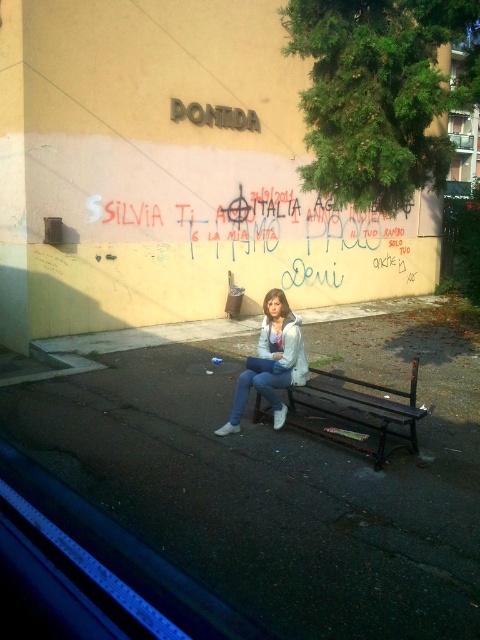
Based on the photo, is red graffiti at center positioned before white matte jacket at center?

No, it is not.

Can you confirm if red graffiti at center is positioned to the right of white matte jacket at center?

Incorrect, red graffiti at center is not on the right side of white matte jacket at center.

Who is more forward, (377, 224) or (279, 324)?

Point (279, 324)

This screenshot has height=640, width=480. What are the coordinates of `red graffiti at center` in the screenshot? It's located at (264, 232).

Who is positioned more to the right, dark brown wooden bench at center or white matte jacket at center?

dark brown wooden bench at center

Can you confirm if dark brown wooden bench at center is smaller than white matte jacket at center?

Incorrect, dark brown wooden bench at center is not smaller in size than white matte jacket at center.

At what (x,y) coordinates should I click in order to perform the action: click on dark brown wooden bench at center. Please return your answer as a coordinate pair (x, y). This screenshot has width=480, height=640. Looking at the image, I should click on (356, 410).

Between red graffiti at center and dark brown wooden bench at center, which one has more height?

With more height is dark brown wooden bench at center.

Is point (383, 221) positioned in front of point (406, 413)?

No, (383, 221) is behind (406, 413).

Between point (368, 220) and point (368, 397), which one is positioned in front?

Point (368, 397)

At what (x,y) coordinates should I click in order to perform the action: click on red graffiti at center. Please return your answer as a coordinate pair (x, y). The image size is (480, 640). Looking at the image, I should click on (264, 232).